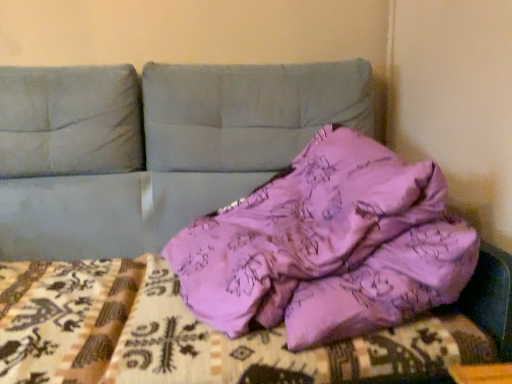
Question: Is pink fabric at center wider or thinner than pink fabric pillow at center?

Choices:
 (A) wide
 (B) thin

Answer: (B)

Question: Considering the positions of pink fabric at center and pink fabric pillow at center in the image, is pink fabric at center bigger or smaller than pink fabric pillow at center?

Choices:
 (A) small
 (B) big

Answer: (A)

Question: From their relative heights in the image, would you say pink fabric at center is taller or shorter than pink fabric pillow at center?

Choices:
 (A) short
 (B) tall

Answer: (A)

Question: Based on their positions, is pink fabric pillow at center located to the left or right of pink fabric at center?

Choices:
 (A) left
 (B) right

Answer: (B)

Question: From the image's perspective, relative to pink fabric at center, is pink fabric pillow at center above or below?

Choices:
 (A) below
 (B) above

Answer: (B)

Question: Looking at the image, does pink fabric pillow at center seem bigger or smaller compared to pink fabric at center?

Choices:
 (A) big
 (B) small

Answer: (A)

Question: Considering the positions of point (324, 279) and point (421, 372), is point (324, 279) closer or farther from the camera than point (421, 372)?

Choices:
 (A) farther
 (B) closer

Answer: (A)